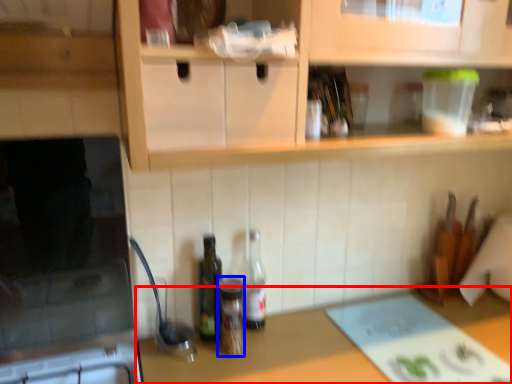
Question: Which of the following is the farthest to the observer, countertop (highlighted by a red box) or bottle (highlighted by a blue box)?

Choices:
 (A) countertop
 (B) bottle

Answer: (B)